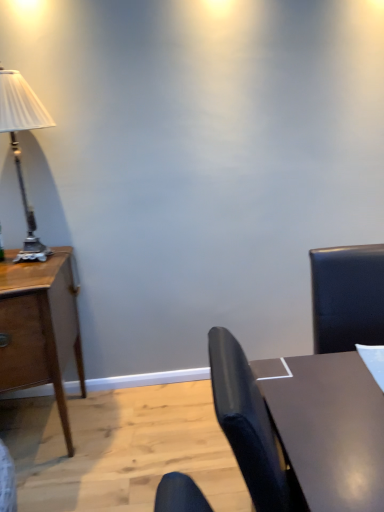
Question: Is wooden desk at left inside shiny brown table at lower right?

Choices:
 (A) yes
 (B) no

Answer: (B)

Question: Is shiny brown table at lower right taller than wooden desk at left?

Choices:
 (A) no
 (B) yes

Answer: (A)

Question: Does shiny brown table at lower right have a lesser width compared to wooden desk at left?

Choices:
 (A) yes
 (B) no

Answer: (A)

Question: Considering the relative sizes of shiny brown table at lower right and wooden desk at left in the image provided, is shiny brown table at lower right wider than wooden desk at left?

Choices:
 (A) no
 (B) yes

Answer: (A)

Question: From the image's perspective, would you say shiny brown table at lower right is positioned over wooden desk at left?

Choices:
 (A) yes
 (B) no

Answer: (B)

Question: Does shiny brown table at lower right come in front of wooden desk at left?

Choices:
 (A) yes
 (B) no

Answer: (A)

Question: From the image's perspective, is silver metallic lamp at left on wooden desk at left?

Choices:
 (A) yes
 (B) no

Answer: (A)

Question: Is wooden desk at left surrounded by silver metallic lamp at left?

Choices:
 (A) yes
 (B) no

Answer: (B)

Question: From a real-world perspective, is silver metallic lamp at left physically below wooden desk at left?

Choices:
 (A) yes
 (B) no

Answer: (B)

Question: Can you confirm if silver metallic lamp at left is positioned to the left of wooden desk at left?

Choices:
 (A) no
 (B) yes

Answer: (A)

Question: Can you confirm if silver metallic lamp at left is smaller than wooden desk at left?

Choices:
 (A) no
 (B) yes

Answer: (B)

Question: Considering the relative positions of silver metallic lamp at left and wooden desk at left in the image provided, is silver metallic lamp at left to the right of wooden desk at left from the viewer's perspective?

Choices:
 (A) no
 (B) yes

Answer: (B)

Question: Does wooden desk at left have a smaller size compared to silver metallic lamp at left?

Choices:
 (A) no
 (B) yes

Answer: (A)